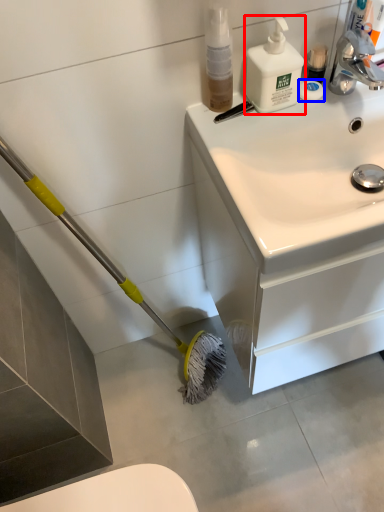
Question: Which object is further to the camera taking this photo, cleaning product (highlighted by a red box) or soap (highlighted by a blue box)?

Choices:
 (A) cleaning product
 (B) soap

Answer: (B)